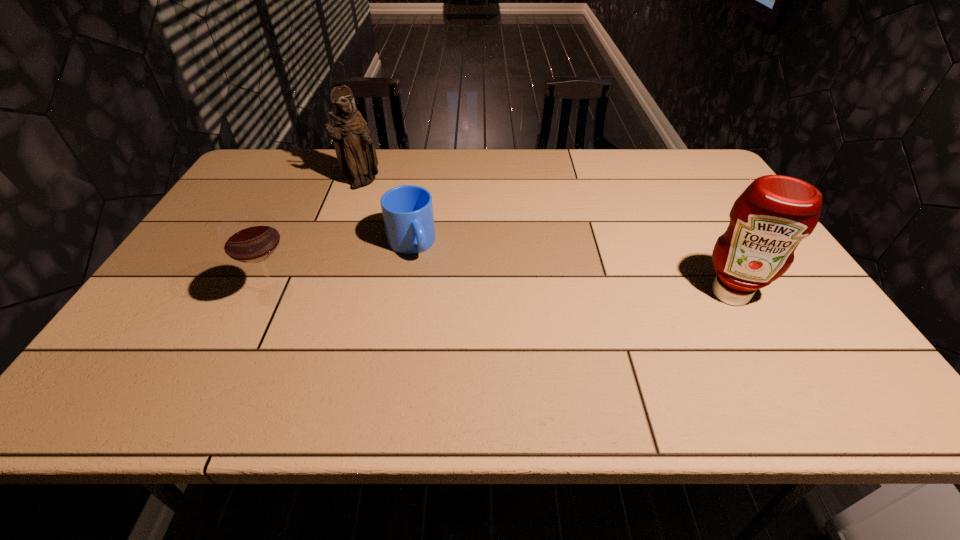
Identify the location of vacant point located between the third object from left to right and the condiment. This screenshot has height=540, width=960. (570, 269).

This screenshot has width=960, height=540. Find the location of `empty space that is in between the condiment and the wineglass`. empty space that is in between the condiment and the wineglass is located at coordinates (503, 294).

You are a GUI agent. You are given a task and a screenshot of the screen. Output one action in this format:
    pyautogui.click(x=<x>, y=<y>)
    Task: Click on the empty space that is in between the condiment and the wineglass
    
    Given the screenshot: What is the action you would take?
    pyautogui.click(x=503, y=294)

Image resolution: width=960 pixels, height=540 pixels. In order to click on free spot between the rightmost object and the mug in this screenshot , I will do `click(570, 269)`.

Locate an element on the screen. This screenshot has width=960, height=540. vacant area that lies between the rightmost object and the farthest object is located at coordinates (546, 238).

The height and width of the screenshot is (540, 960). In order to click on vacant point located between the figurine and the wineglass in this screenshot , I will do `click(319, 238)`.

Where is `empty space between the wineglass and the mug`? This screenshot has height=540, width=960. empty space between the wineglass and the mug is located at coordinates (344, 269).

Select which object is the third closest to the shortest object. Please provide its 2D coordinates. Your answer should be formatted as a tuple, i.e. [(x, y)], where the tuple contains the x and y coordinates of a point satisfying the conditions above.

[(771, 217)]

Locate which object ranks second in proximity to the condiment. Please provide its 2D coordinates. Your answer should be formatted as a tuple, i.e. [(x, y)], where the tuple contains the x and y coordinates of a point satisfying the conditions above.

[(356, 154)]

Identify the location of free space that satisfies the following two spatial constraints: 1. on the front side of the shortest object; 2. on the right side of the farthest object. pos(340,244).